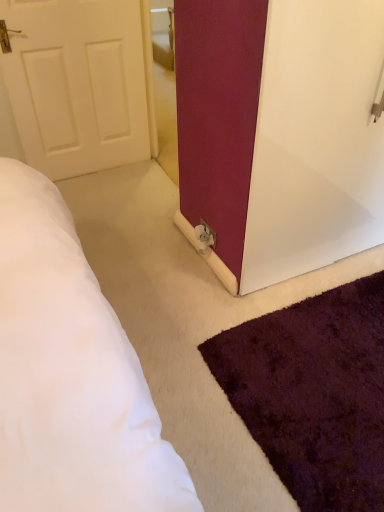
Question: Does white glossy door at center come behind shaggy purple rug at lower right?

Choices:
 (A) yes
 (B) no

Answer: (A)

Question: Is white glossy door at center smaller than shaggy purple rug at lower right?

Choices:
 (A) yes
 (B) no

Answer: (B)

Question: Can you confirm if white glossy door at center is taller than shaggy purple rug at lower right?

Choices:
 (A) yes
 (B) no

Answer: (A)

Question: Is white glossy door at center wider than shaggy purple rug at lower right?

Choices:
 (A) no
 (B) yes

Answer: (A)

Question: Would you consider white glossy door at center to be distant from shaggy purple rug at lower right?

Choices:
 (A) yes
 (B) no

Answer: (B)

Question: Is white glossy door at center shorter than shaggy purple rug at lower right?

Choices:
 (A) yes
 (B) no

Answer: (B)

Question: From the image's perspective, is shaggy purple rug at lower right located above white glossy door at center?

Choices:
 (A) no
 (B) yes

Answer: (A)

Question: Is shaggy purple rug at lower right facing away from white glossy door at center?

Choices:
 (A) no
 (B) yes

Answer: (A)

Question: Can you confirm if shaggy purple rug at lower right is bigger than white glossy door at center?

Choices:
 (A) no
 (B) yes

Answer: (A)

Question: Is shaggy purple rug at lower right next to white glossy door at center and touching it?

Choices:
 (A) yes
 (B) no

Answer: (B)

Question: Is shaggy purple rug at lower right not close to white glossy door at center?

Choices:
 (A) yes
 (B) no

Answer: (B)

Question: Is shaggy purple rug at lower right to the left of white glossy door at center from the viewer's perspective?

Choices:
 (A) no
 (B) yes

Answer: (A)

Question: Considering their positions, is shaggy purple rug at lower right located in front of or behind white glossy door at center?

Choices:
 (A) behind
 (B) front

Answer: (B)